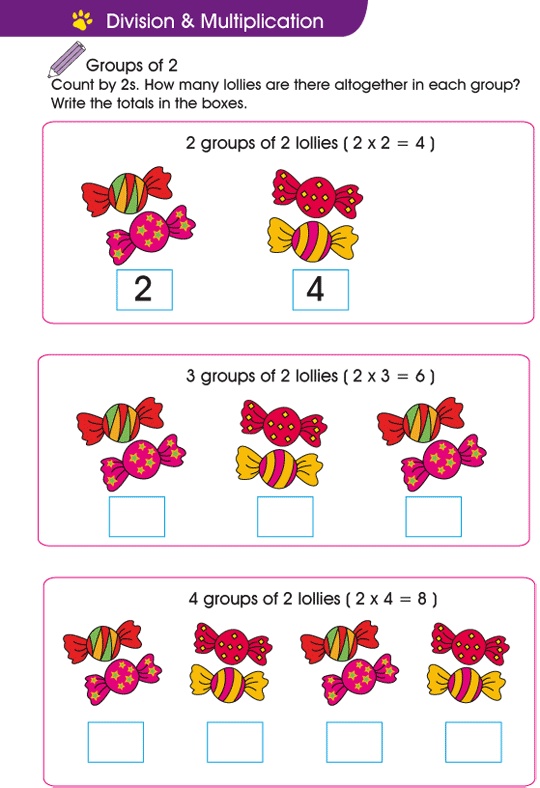
Where is `boxes`? boxes is located at coordinates (109, 760), (226, 745), (340, 748), (494, 748), (438, 514), (288, 511), (119, 519), (144, 291), (332, 292).